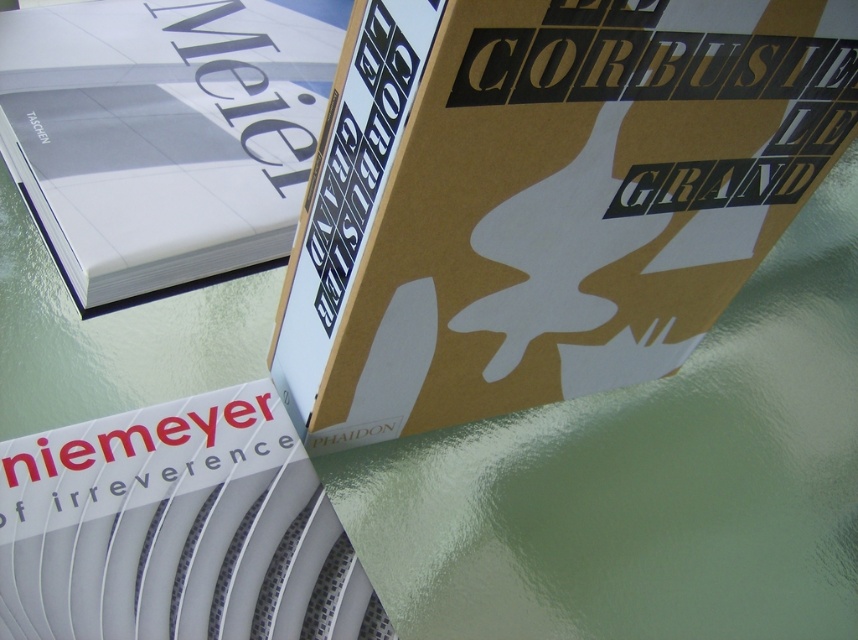
Who is taller, gold matte book at upper right or white matte book at center?

Standing taller between the two is gold matte book at upper right.

Which is behind, point (409, 332) or point (354, 620)?

The point (409, 332) is behind.

I want to click on gold matte book at upper right, so click(x=544, y=196).

Which is in front, point (289, 138) or point (396, 637)?

Point (396, 637) is more forward.

Measure the distance between matte white book at upper left and camera.

The distance of matte white book at upper left from camera is 26.49 inches.

Locate an element on the screen. The image size is (858, 640). matte white book at upper left is located at coordinates (164, 132).

Does point (479, 113) come behind point (288, 67)?

No.

Who is taller, gold matte book at upper right or matte white book at upper left?

Standing taller between the two is matte white book at upper left.

At what (x,y) coordinates should I click in order to perform the action: click on gold matte book at upper right. Please return your answer as a coordinate pair (x, y). The height and width of the screenshot is (640, 858). Looking at the image, I should click on click(544, 196).